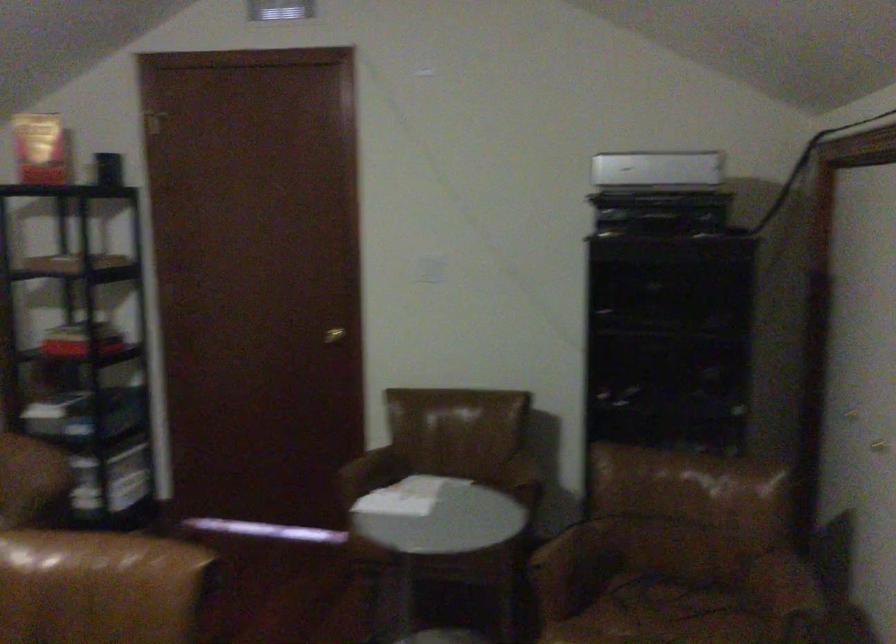
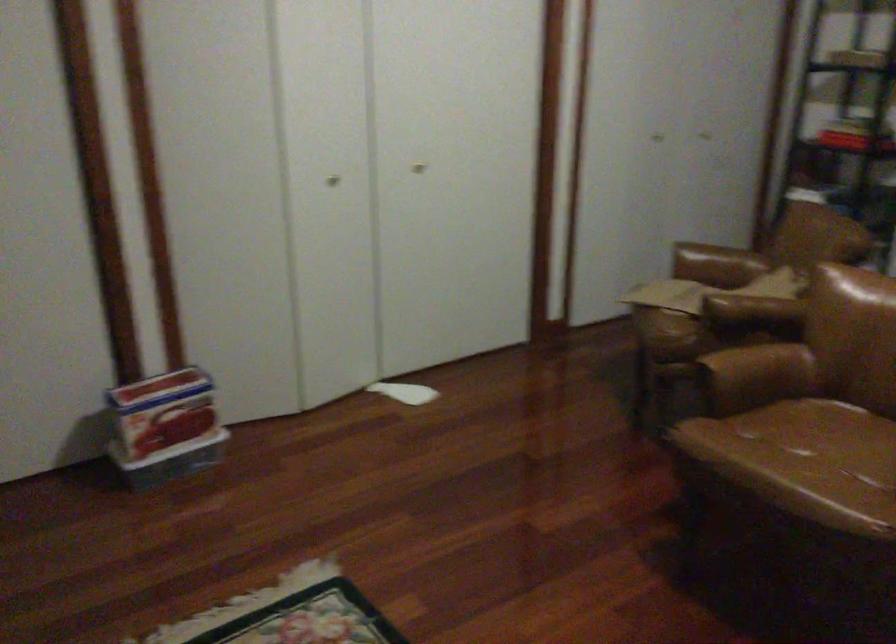
Question: The images are taken continuously from a first-person perspective. In which direction is your viewpoint rotating?

Choices:
 (A) Left
 (B) Right
 (C) Up
 (D) Down

Answer: (A)